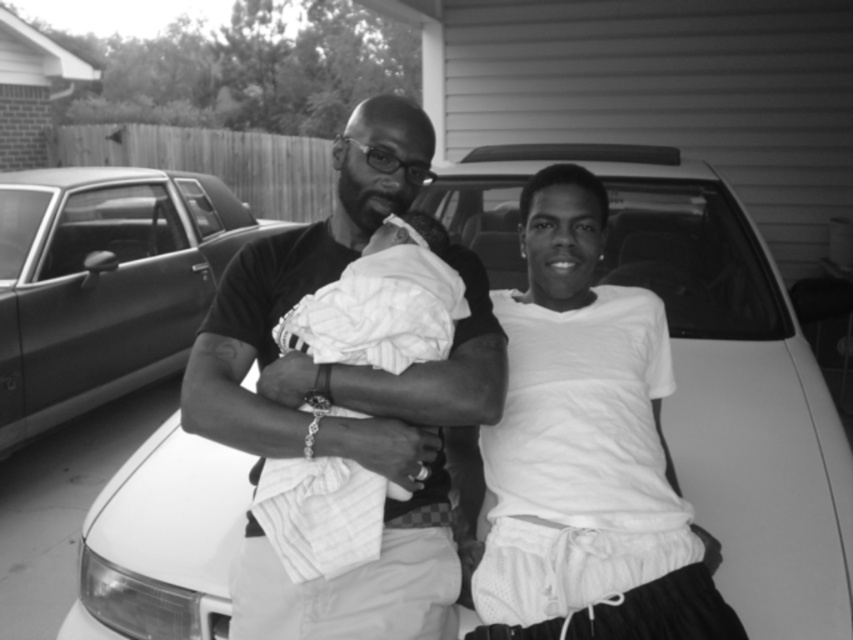
Question: Is white mesh shorts at center to the right of metallic silver car at left from the viewer's perspective?

Choices:
 (A) no
 (B) yes

Answer: (B)

Question: Which point is closer to the camera?

Choices:
 (A) (16, 333)
 (B) (541, 627)
 (C) (718, 531)
 (D) (294, 476)

Answer: (B)

Question: Based on their relative distances, which object is farther from the metallic silver car at left?

Choices:
 (A) white matte car at center
 (B) matte black t-shirt at center
 (C) white mesh shorts at center
 (D) white soft cloth at center

Answer: (D)

Question: Based on their relative distances, which object is farther from the white soft cloth at center?

Choices:
 (A) matte black t-shirt at center
 (B) metallic silver car at left
 (C) white mesh shorts at center

Answer: (B)

Question: Can you confirm if white mesh shorts at center is positioned to the left of white soft cloth at center?

Choices:
 (A) yes
 (B) no

Answer: (B)

Question: Where is white matte car at center located in relation to white mesh shorts at center in the image?

Choices:
 (A) above
 (B) below

Answer: (A)